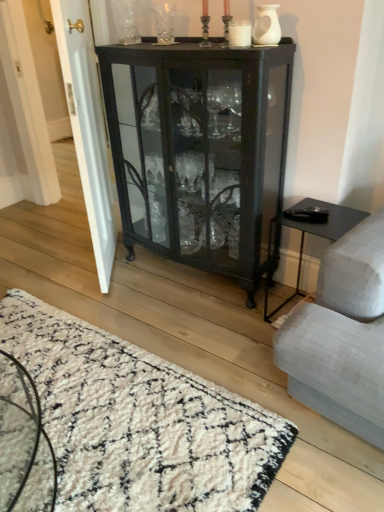
I want to click on unoccupied area in front of black glass cabinet at center, so click(x=196, y=328).